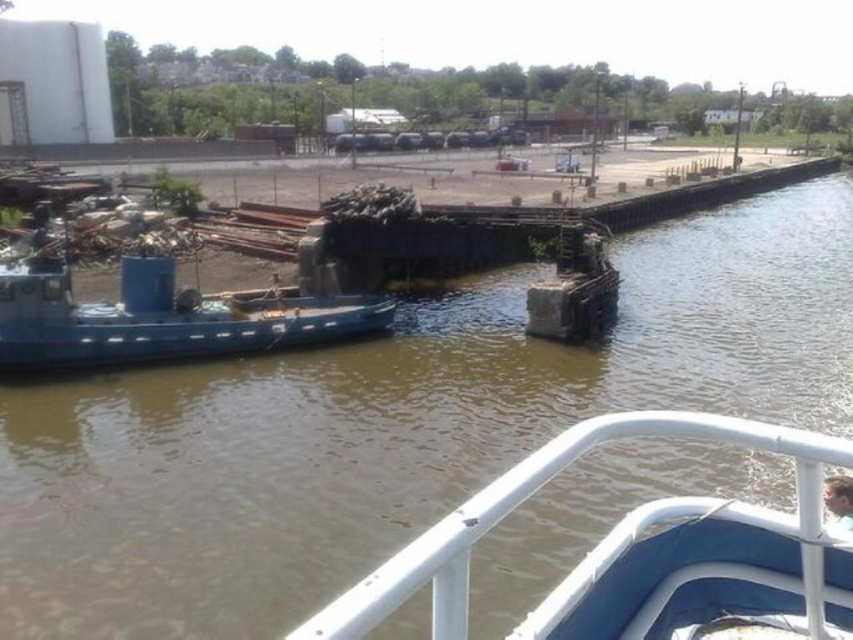
You are navigating a small boat and need to determine the closest point to your current position. You see two points marked in the scene. Which point is closer to you? The points are point (125, 292) and point (842, 492).

Point (125, 292) is closer to you because it is further to the viewer than point (842, 492), meaning it is nearer in the scene.

You are on a small boat that is 2 meters wide. You want to pass through the gap between the white matte rail at lower center and the blue matte boat at left. Can your boat fit through the gap?

The white matte rail at lower center is wider than the blue matte boat at left. However, the exact width of the gap isn t specified in the object descriptions. Since the question requires knowing if the 2m wide boat can fit, but the provided information only compares their widths without giving numerical measurements, we cannot determine the gap s width. More information is needed.

You are a photographer standing on a boat and want to take a picture of the white matte rail at lower center and the smooth skin face at lower right. Since you want both subjects to be in focus, which one should you focus on first to ensure depth of field?

The white matte rail at lower center is taller than the smooth skin face at lower right, so you should focus on the white matte rail at lower center first to ensure both are in focus.